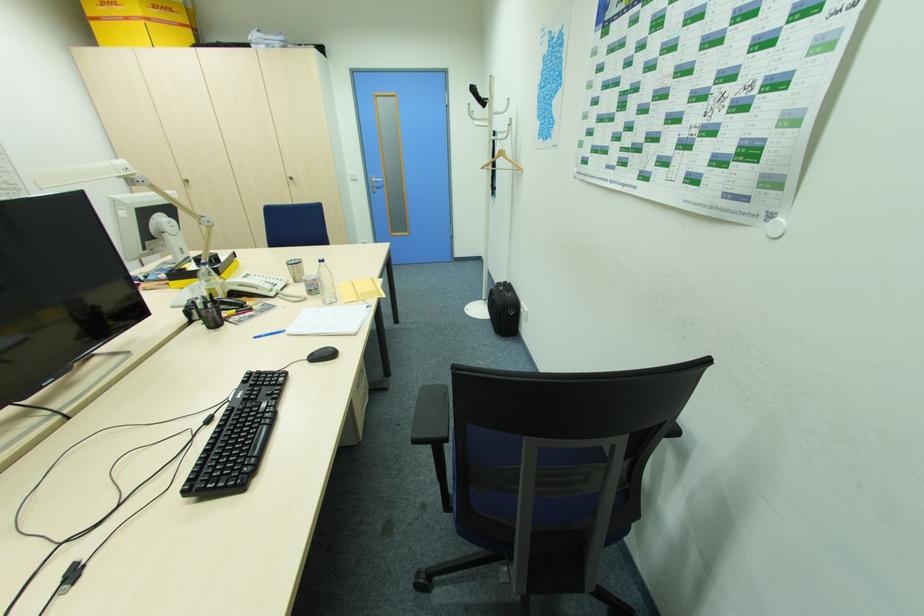
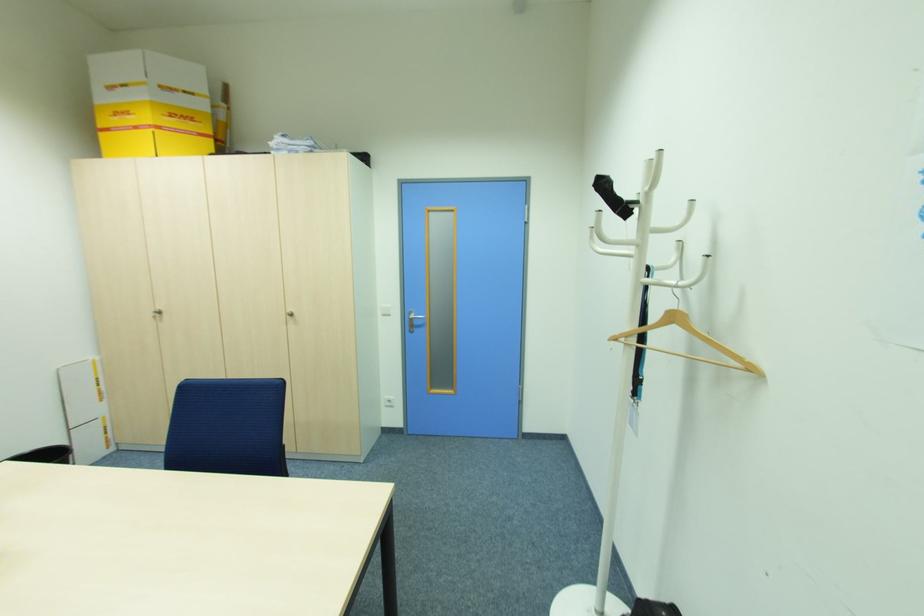
Locate, in the second image, the point that corresponds to (x=292, y=176) in the first image.

(292, 310)